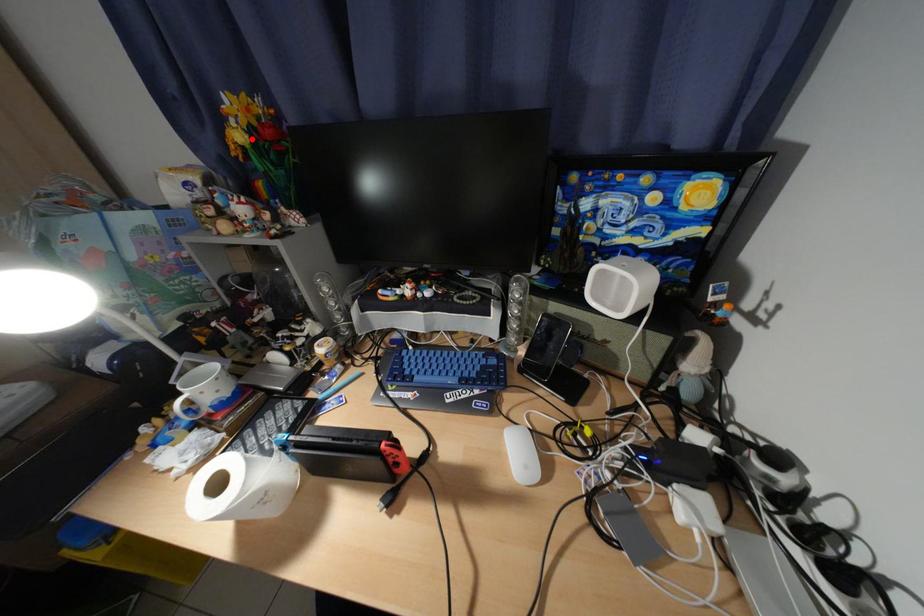
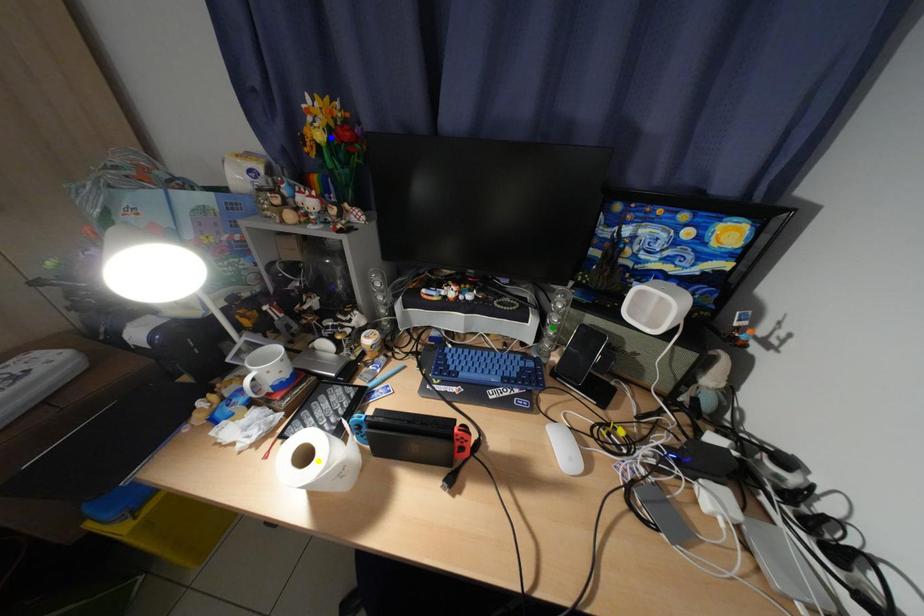
Question: I am providing you with two images of the same scene from different viewpoints. A red point is marked on the first image. You are given multiple points on the second image. Which spot in image 2 lines up with the point in image 1?

Choices:
 (A) blue point
 (B) yellow point
 (C) green point

Answer: (A)